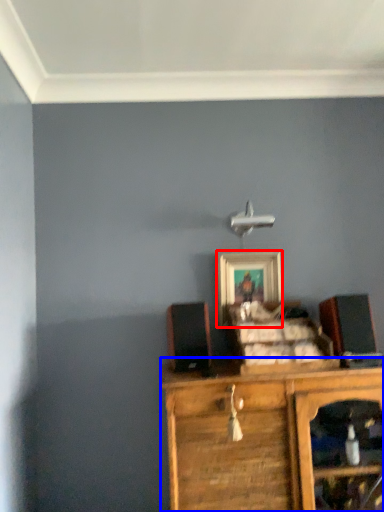
Question: Which object is closer to the camera taking this photo, picture frame (highlighted by a red box) or chest of drawers (highlighted by a blue box)?

Choices:
 (A) picture frame
 (B) chest of drawers

Answer: (B)